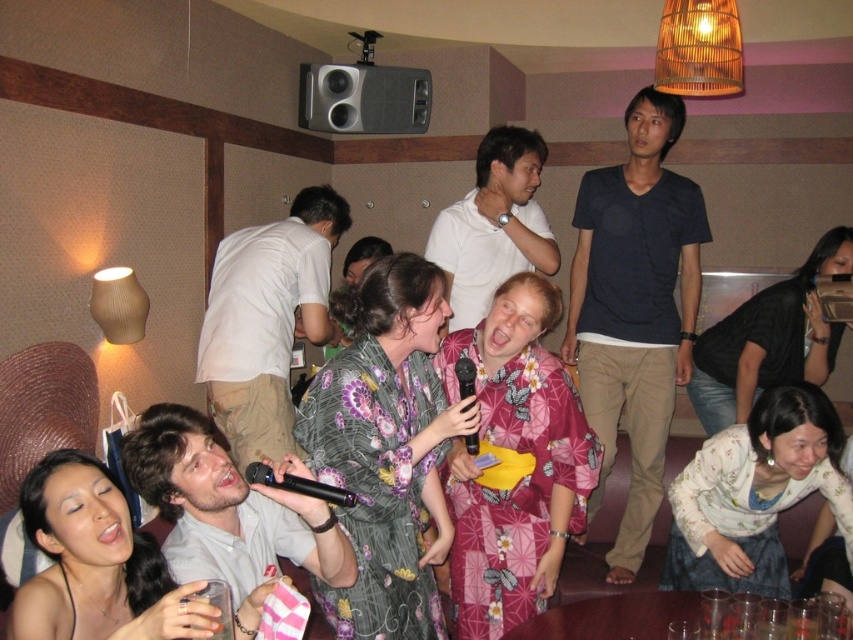
You are a GUI agent. You are given a task and a screenshot of the screen. Output one action in this format:
    pyautogui.click(x=<x>, y=<y>)
    Task: Click on the dark blue cotton t-shirt at upper center
    Image resolution: width=853 pixels, height=640 pixels.
    Given the screenshot: What is the action you would take?
    pyautogui.click(x=635, y=308)

Does point (654, 317) lie in front of point (286, 483)?

No, it is not.

Which is in front, point (596, 268) or point (312, 483)?

Point (312, 483) is more forward.

This screenshot has width=853, height=640. Find the location of `dark blue cotton t-shirt at upper center`. dark blue cotton t-shirt at upper center is located at coordinates (635, 308).

Does white cotton shirt at center come behind matte gray speaker at upper center?

No, white cotton shirt at center is closer to the viewer.

Is point (210, 388) behind point (352, 97)?

No, it is in front of (352, 97).

Describe the element at coordinates (265, 321) in the screenshot. I see `white cotton shirt at center` at that location.

Image resolution: width=853 pixels, height=640 pixels. In order to click on white cotton shirt at center in this screenshot , I will do `click(265, 321)`.

Is matte gray speaker at upper center taller than black plastic microphone at lower center?

Indeed, matte gray speaker at upper center has a greater height compared to black plastic microphone at lower center.

The width and height of the screenshot is (853, 640). What do you see at coordinates (363, 99) in the screenshot? I see `matte gray speaker at upper center` at bounding box center [363, 99].

Locate an element on the screen. The image size is (853, 640). matte gray speaker at upper center is located at coordinates (363, 99).

Find the location of `matte gray speaker at upper center`. matte gray speaker at upper center is located at coordinates (363, 99).